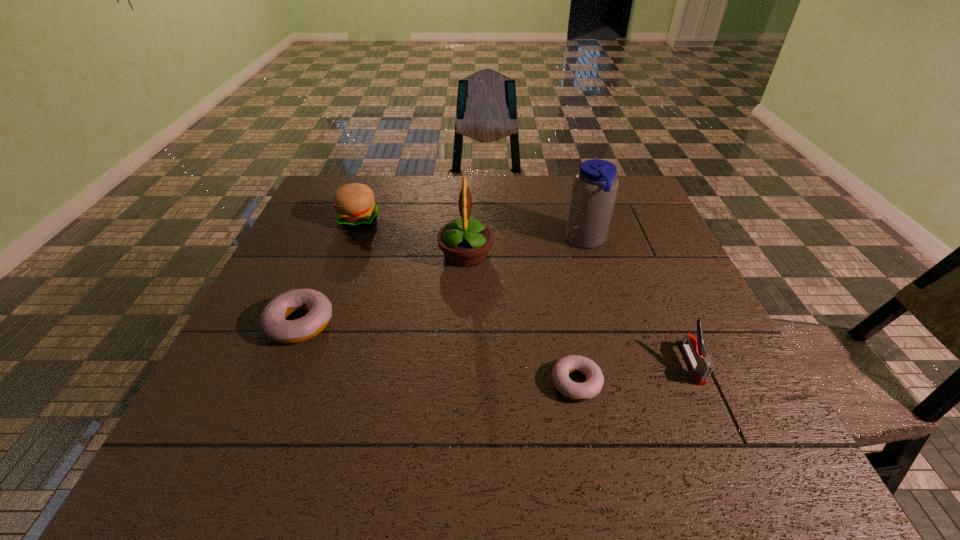
If equal spacing is the goal by inserting an additional doughnut among them, please point out a vacant space for this new doughnut. Please provide its 2D coordinates. Your answer should be formatted as a tuple, i.e. [(x, y)], where the tuple contains the x and y coordinates of a point satisfying the conditions above.

[(429, 351)]